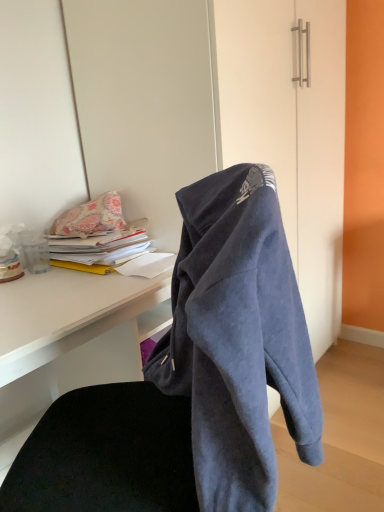
Question: Considering their positions, is yellow paper at left located in front of or behind floral fabric pillow at upper left?

Choices:
 (A) front
 (B) behind

Answer: (A)

Question: Is yellow paper at left spatially inside floral fabric pillow at upper left, or outside of it?

Choices:
 (A) outside
 (B) inside

Answer: (A)

Question: Based on their relative distances, which object is farther from the matte white desk at center?

Choices:
 (A) dark blue fleece hoodie at center
 (B) yellow paper at left
 (C) floral fabric pillow at upper left

Answer: (A)

Question: Which is nearer to the matte white desk at center?

Choices:
 (A) floral fabric pillow at upper left
 (B) dark blue fleece hoodie at center
 (C) yellow paper at left

Answer: (C)